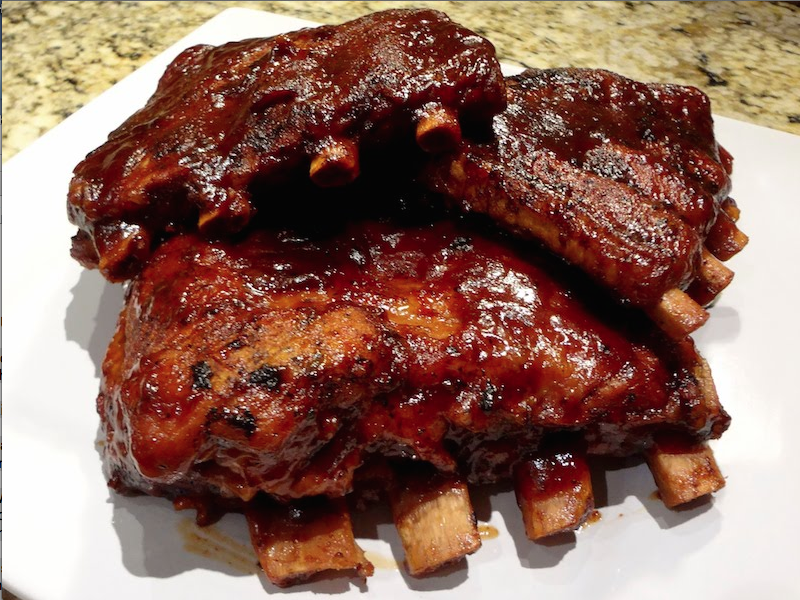
The height and width of the screenshot is (600, 800). In order to click on plate in this screenshot , I will do tap(54, 485).